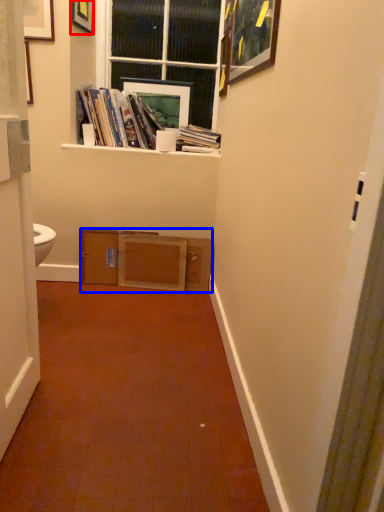
Question: Among these objects, which one is nearest to the camera, picture frame (highlighted by a red box) or cabinetry (highlighted by a blue box)?

Choices:
 (A) picture frame
 (B) cabinetry

Answer: (A)